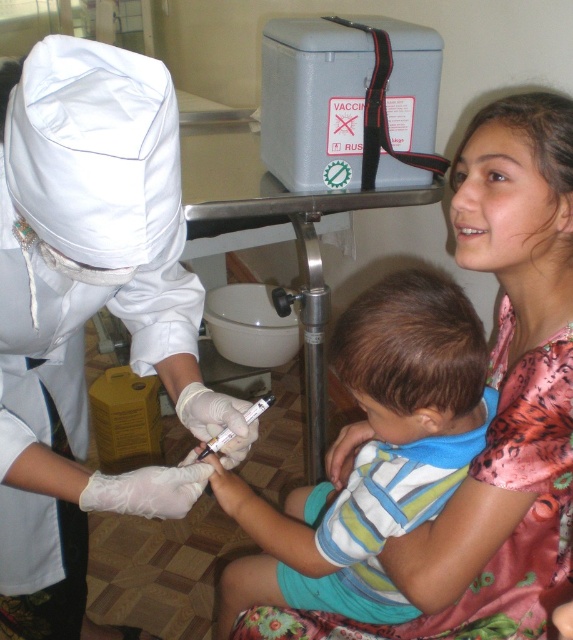
Who is taller, white matte uniform at center or white plastic syringe at center?

With more height is white matte uniform at center.

From the picture: Does white matte uniform at center have a greater width compared to white plastic syringe at center?

Yes, white matte uniform at center is wider than white plastic syringe at center.

Is point (103, 180) farther from camera compared to point (246, 416)?

No.

This screenshot has height=640, width=573. I want to click on white matte uniform at center, so click(88, 314).

From the picture: Does striped cotton shirt at center appear under white plastic syringe at center?

Indeed, striped cotton shirt at center is positioned under white plastic syringe at center.

Measure the distance between striped cotton shirt at center and camera.

striped cotton shirt at center and camera are 30.49 inches apart.

In order to click on striped cotton shirt at center in this screenshot , I will do `click(371, 454)`.

Is point (81, 42) in front of point (370, 294)?

Yes, it is.

Consider the image. Who is more forward, (x=142, y=160) or (x=308, y=532)?

Point (x=142, y=160) is in front.

This screenshot has width=573, height=640. What are the coordinates of `white matte uniform at center` in the screenshot? It's located at (88, 314).